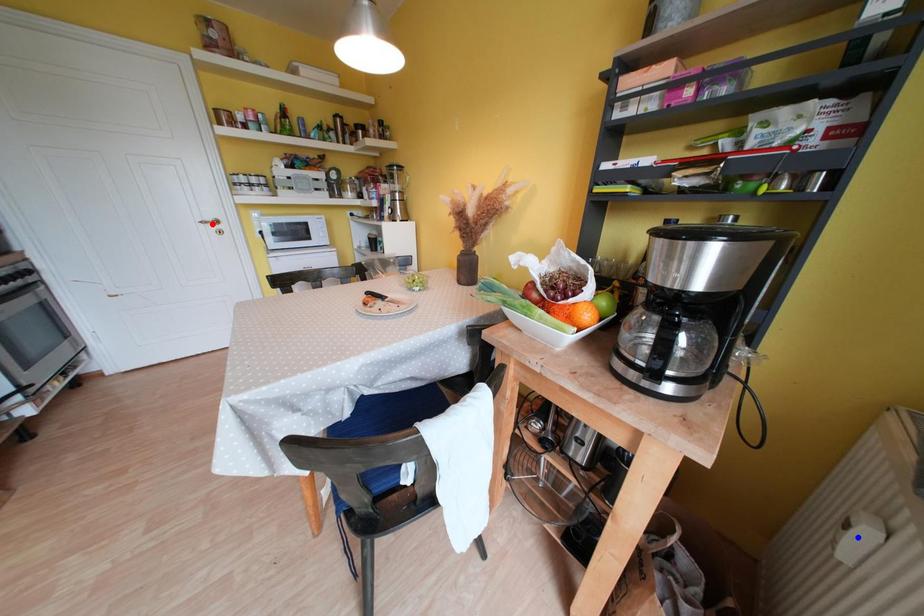
Question: Which of the two points in the image is closer to the camera?

Choices:
 (A) Blue point is closer.
 (B) Red point is closer.

Answer: (A)